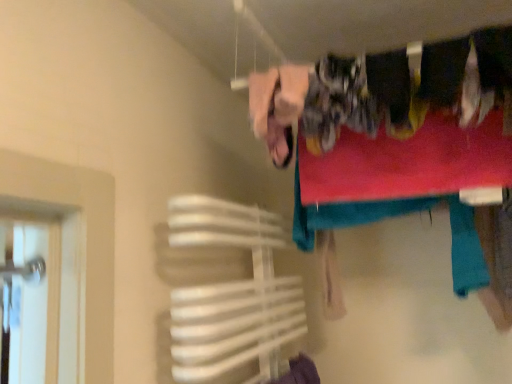
In order to click on white plastic towel rack at lower left in this screenshot , I will do click(x=229, y=292).

What do you see at coordinates (229, 292) in the screenshot? This screenshot has width=512, height=384. I see `white plastic towel rack at lower left` at bounding box center [229, 292].

Image resolution: width=512 pixels, height=384 pixels. What are the coordinates of `white plastic towel rack at lower left` in the screenshot? It's located at (229, 292).